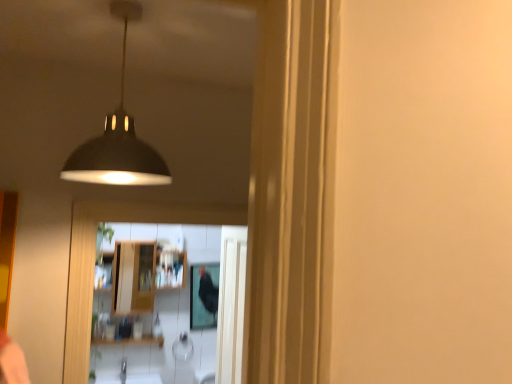
Question: Does black glossy mirror at center lie behind matte black lampshade at upper center?

Choices:
 (A) no
 (B) yes

Answer: (B)

Question: Is black glossy mirror at center closer to camera compared to matte black lampshade at upper center?

Choices:
 (A) yes
 (B) no

Answer: (B)

Question: Is black glossy mirror at center wider than matte black lampshade at upper center?

Choices:
 (A) no
 (B) yes

Answer: (A)

Question: From the image's perspective, is black glossy mirror at center above matte black lampshade at upper center?

Choices:
 (A) yes
 (B) no

Answer: (B)

Question: From a real-world perspective, is black glossy mirror at center positioned under matte black lampshade at upper center based on gravity?

Choices:
 (A) yes
 (B) no

Answer: (A)

Question: Considering the relative sizes of black glossy mirror at center and matte black lampshade at upper center in the image provided, is black glossy mirror at center taller than matte black lampshade at upper center?

Choices:
 (A) no
 (B) yes

Answer: (B)

Question: Is matte black lampshade at upper center at the right side of black glossy mirror at center?

Choices:
 (A) yes
 (B) no

Answer: (B)

Question: Is matte black lampshade at upper center bigger than black glossy mirror at center?

Choices:
 (A) yes
 (B) no

Answer: (A)

Question: From a real-world perspective, is matte black lampshade at upper center positioned over black glossy mirror at center based on gravity?

Choices:
 (A) yes
 (B) no

Answer: (A)

Question: From a real-world perspective, is matte black lampshade at upper center under black glossy mirror at center?

Choices:
 (A) yes
 (B) no

Answer: (B)

Question: Considering the relative sizes of matte black lampshade at upper center and black glossy mirror at center in the image provided, is matte black lampshade at upper center thinner than black glossy mirror at center?

Choices:
 (A) no
 (B) yes

Answer: (A)

Question: Is matte black lampshade at upper center at the left side of black glossy mirror at center?

Choices:
 (A) yes
 (B) no

Answer: (A)

Question: In the image, is matte black lampshade at upper center positioned in front of or behind black glossy mirror at center?

Choices:
 (A) front
 (B) behind

Answer: (A)